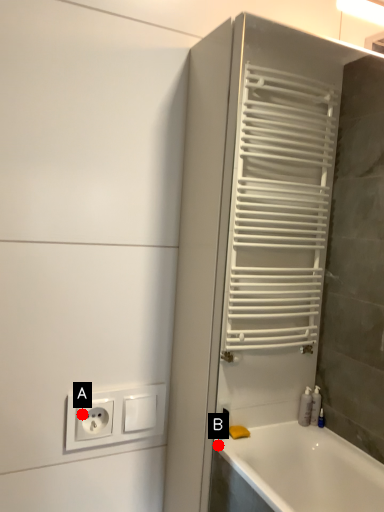
Question: Two points are circled on the image, labeled by A and B beside each circle. Among these points, which one is nearest to the camera?

Choices:
 (A) A is closer
 (B) B is closer

Answer: (A)